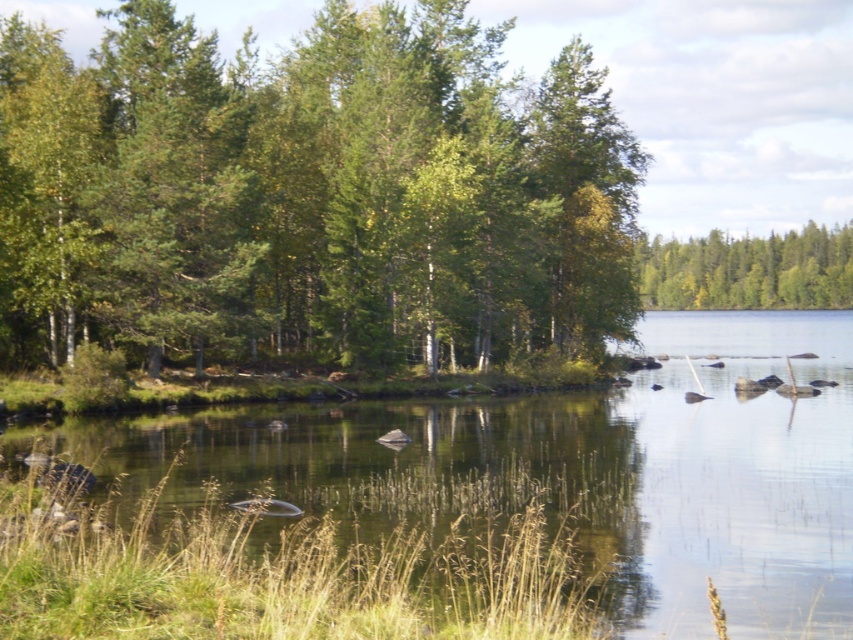
Question: Is green leafy trees at center thinner than green leafy trees at upper right?

Choices:
 (A) no
 (B) yes

Answer: (A)

Question: Can you confirm if green leafy trees at center is positioned to the right of green leafy trees at upper right?

Choices:
 (A) no
 (B) yes

Answer: (A)

Question: Does green leafy trees at center come in front of green leafy trees at upper right?

Choices:
 (A) no
 (B) yes

Answer: (B)